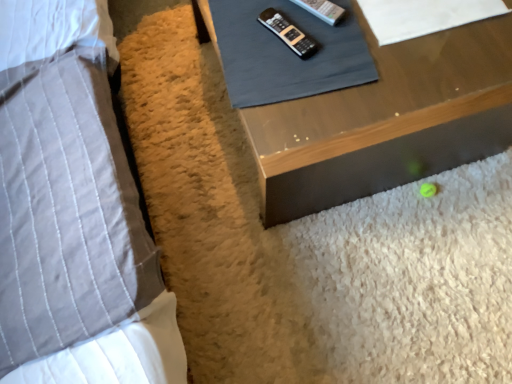
At what (x,y) coordinates should I click in order to perform the action: click on free location to the right of black plastic remote at upper center. Please return your answer as a coordinate pair (x, y). Looking at the image, I should click on (351, 39).